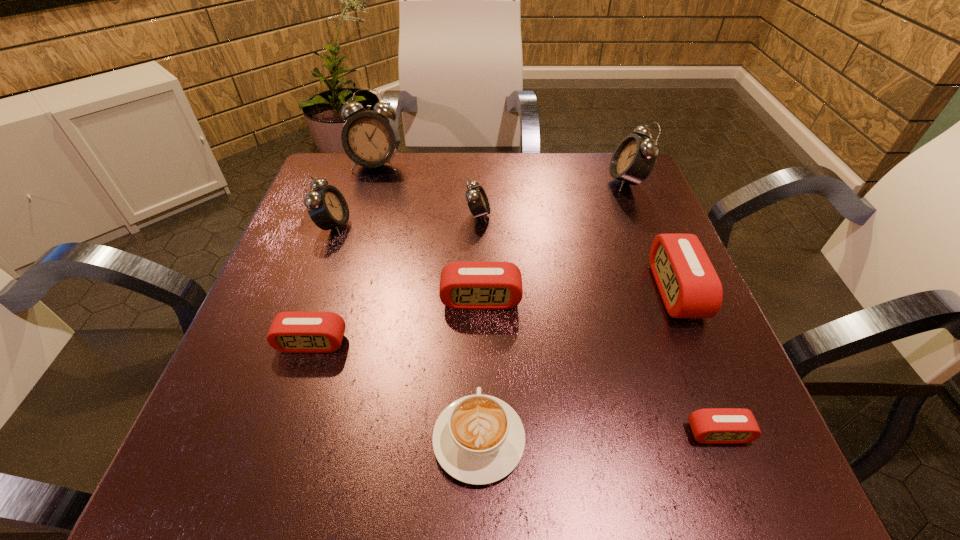
Find the location of a particular element. empty location between the biggest white alarm clock and the third tallest object is located at coordinates (355, 195).

Where is `empty space between the third pink alarm clock from right to left and the second white alarm clock from right to left`? This screenshot has height=540, width=960. empty space between the third pink alarm clock from right to left and the second white alarm clock from right to left is located at coordinates (480, 257).

Where is `vacant space in between the seventh farthest object and the third tallest alarm clock`? The width and height of the screenshot is (960, 540). vacant space in between the seventh farthest object and the third tallest alarm clock is located at coordinates (323, 284).

You are a GUI agent. You are given a task and a screenshot of the screen. Output one action in this format:
    pyautogui.click(x=<x>, y=<y>)
    Task: Click on the unoccupied area between the biggest white alarm clock and the third smallest white alarm clock
    The image size is (960, 540).
    Given the screenshot: What is the action you would take?
    pyautogui.click(x=501, y=173)

Identify the location of unoccupied position between the second white alarm clock from right to left and the nearest alarm clock. This screenshot has height=540, width=960. pyautogui.click(x=598, y=324).

Image resolution: width=960 pixels, height=540 pixels. What are the coordinates of `free space that is in between the white cappuccino and the biggest pink alarm clock` in the screenshot? It's located at 577,365.

You are a GUI agent. You are given a task and a screenshot of the screen. Output one action in this format:
    pyautogui.click(x=<x>, y=<y>)
    Task: Click on the empty space between the leftmost pink alarm clock and the nearest pink alarm clock
    
    Given the screenshot: What is the action you would take?
    pyautogui.click(x=515, y=388)

Locate an element on the screen. The image size is (960, 540). free space between the smallest white alarm clock and the seventh shortest alarm clock is located at coordinates (553, 198).

Image resolution: width=960 pixels, height=540 pixels. What are the coordinates of `vacant space in between the third white alarm clock from left to right and the third tallest object` in the screenshot? It's located at (406, 220).

Select which object is the closest to the second biggest pink alarm clock. Please provide its 2D coordinates. Your answer should be formatted as a tuple, i.e. [(x, y)], where the tuple contains the x and y coordinates of a point satisfying the conditions above.

[(292, 332)]